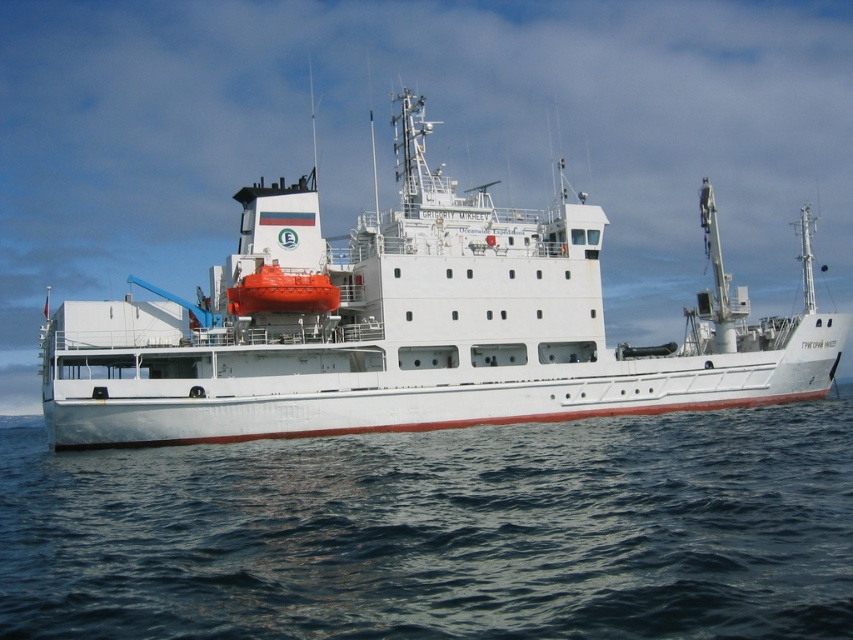
Question: Does blue water at lower center appear on the right side of white matte ship at center?

Choices:
 (A) no
 (B) yes

Answer: (B)

Question: Can you confirm if blue water at lower center is positioned above white matte ship at center?

Choices:
 (A) no
 (B) yes

Answer: (A)

Question: Does blue water at lower center have a lesser width compared to white matte ship at center?

Choices:
 (A) yes
 (B) no

Answer: (A)

Question: Which point is farther to the camera?

Choices:
 (A) (358, 218)
 (B) (114, 525)

Answer: (A)

Question: Which point is closer to the camera taking this photo?

Choices:
 (A) (553, 618)
 (B) (408, 410)

Answer: (A)